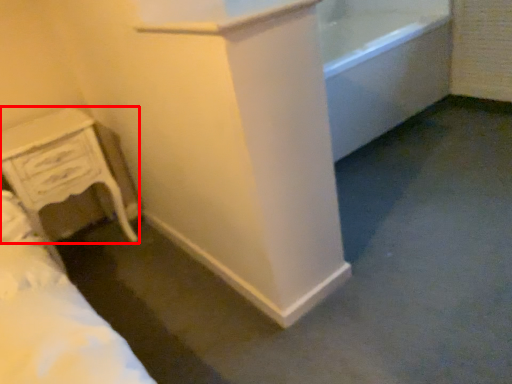
Question: From the image's perspective, where is chest of drawers (annotated by the red box) located relative to bath?

Choices:
 (A) below
 (B) above

Answer: (A)